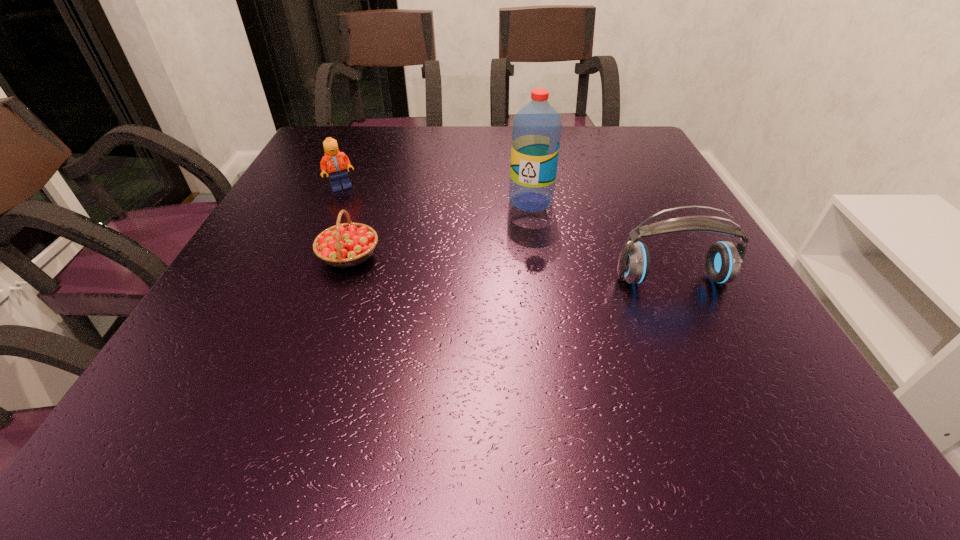
The width and height of the screenshot is (960, 540). Identify the location of unoccupied position between the water bottle and the rightmost object. (602, 240).

The height and width of the screenshot is (540, 960). I want to click on vacant area that lies between the third object from left to right and the Lego, so click(436, 194).

Locate an element on the screen. The image size is (960, 540). object identified as the second closest to the water bottle is located at coordinates (349, 244).

Where is `object that stands as the closest to the strawberry`? object that stands as the closest to the strawberry is located at coordinates (336, 163).

Where is `blank area in the image that satisfies the following two spatial constraints: 1. on the back side of the tallest object; 2. on the left side of the shortest object`? Image resolution: width=960 pixels, height=540 pixels. blank area in the image that satisfies the following two spatial constraints: 1. on the back side of the tallest object; 2. on the left side of the shortest object is located at coordinates pos(368,201).